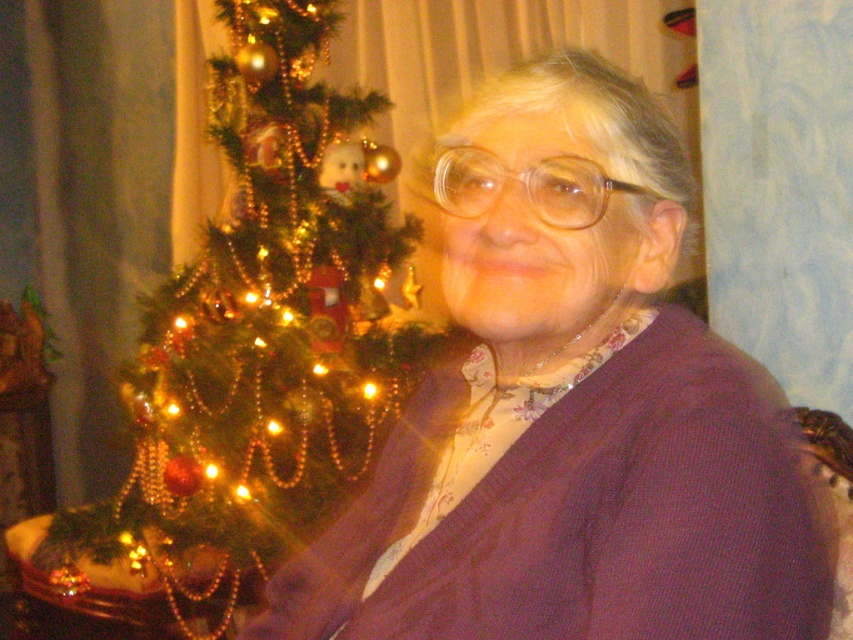
Question: Is purple knitted sweater at center wider than green textured christmas tree at left?

Choices:
 (A) no
 (B) yes

Answer: (A)

Question: In this image, where is purple knitted sweater at center located relative to green textured christmas tree at left?

Choices:
 (A) left
 (B) right

Answer: (B)

Question: Which object appears closest to the camera in this image?

Choices:
 (A) green textured christmas tree at left
 (B) purple knitted sweater at center

Answer: (B)

Question: Among these objects, which one is nearest to the camera?

Choices:
 (A) purple knitted sweater at center
 (B) green textured christmas tree at left

Answer: (A)

Question: Does purple knitted sweater at center lie behind green textured christmas tree at left?

Choices:
 (A) no
 (B) yes

Answer: (A)

Question: Which point is closer to the camera taking this photo?

Choices:
 (A) (223, 529)
 (B) (769, 451)

Answer: (B)